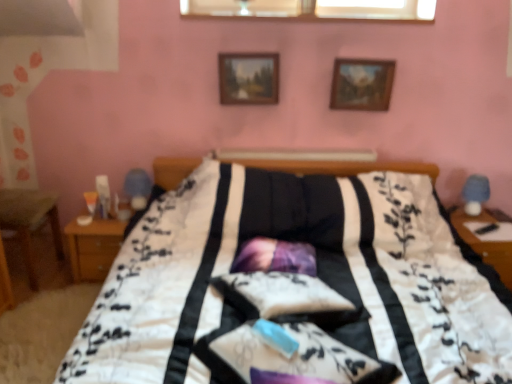
You are a GUI agent. You are given a task and a screenshot of the screen. Output one action in this format:
    pyautogui.click(x=<x>, y=<y>)
    Task: Click on the vacant space in front of blue fabric table lamp at right
    This screenshot has height=384, width=512.
    Given the screenshot: What is the action you would take?
    pyautogui.click(x=481, y=222)